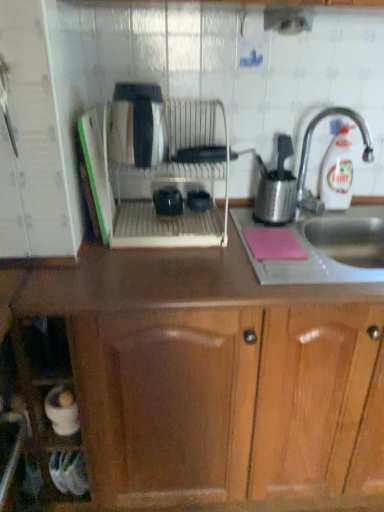
Locate an element on the screen. This screenshot has height=512, width=384. satin silver dish rack at center is located at coordinates (157, 179).

In order to face wooden cabinet at center, should I rotate leftwards or rightwards?

It's best to rotate right around 9.785 degrees.

The width and height of the screenshot is (384, 512). What do you see at coordinates (276, 188) in the screenshot?
I see `stainless steel utensil holder at right` at bounding box center [276, 188].

What do you see at coordinates (309, 154) in the screenshot?
I see `silver metallic tap at right` at bounding box center [309, 154].

The width and height of the screenshot is (384, 512). What do you see at coordinates (326, 248) in the screenshot?
I see `metallic sink at right` at bounding box center [326, 248].

Measure the distance between metallic sink at right and camera.

They are 38.24 inches apart.

Locate an element on the screen. Image resolution: width=384 pixels, height=512 pixels. satin silver dish rack at center is located at coordinates (157, 179).

Who is smaller, silver metallic tap at right or wooden cabinet at center?

silver metallic tap at right is smaller.

Which is more to the left, silver metallic tap at right or wooden cabinet at center?

wooden cabinet at center.

Is silver metallic tap at right thinner than wooden cabinet at center?

Correct, the width of silver metallic tap at right is less than that of wooden cabinet at center.

Is the depth of white plastic bottle at upper right greater than that of satin silver dish rack at center?

Yes, it is behind satin silver dish rack at center.

In terms of width, does white plastic bottle at upper right look wider or thinner when compared to satin silver dish rack at center?

white plastic bottle at upper right is thinner than satin silver dish rack at center.

From a real-world perspective, is white plastic bottle at upper right physically located above or below satin silver dish rack at center?

Clearly, from a real-world perspective, white plastic bottle at upper right is below satin silver dish rack at center.

Is white plastic bottle at upper right touching satin silver dish rack at center?

No, white plastic bottle at upper right is not with satin silver dish rack at center.

Based on their sizes in the image, would you say matte black mugs at center, which is the second appliance in right-to-left order, is bigger or smaller than pink matte notepad at lower right?

matte black mugs at center, which is the second appliance in right-to-left order, is smaller than pink matte notepad at lower right.

In the scene shown: Is the depth of matte black mugs at center, which is the first appliance in left-to-right order, less than that of pink matte notepad at lower right?

No, matte black mugs at center, which is the first appliance in left-to-right order, is further to the viewer.

From a real-world perspective, is matte black mugs at center, which is the first appliance in left-to-right order, positioned above or below pink matte notepad at lower right?

From a real-world perspective, matte black mugs at center, which is the first appliance in left-to-right order, is physically above pink matte notepad at lower right.

Is matte black mugs at center, which is the first appliance in left-to-right order, touching pink matte notepad at lower right?

No, matte black mugs at center, which is the first appliance in left-to-right order, is not touching pink matte notepad at lower right.

Is point (255, 246) farther from camera compared to point (337, 109)?

No, (255, 246) is in front of (337, 109).

Is pink matte notepad at lower right aimed at silver metallic tap at right?

No, pink matte notepad at lower right is not aimed at silver metallic tap at right.

Can you confirm if pink matte notepad at lower right is taller than silver metallic tap at right?

No.

Which object is closer to the camera, pink matte notepad at lower right or silver metallic tap at right?

silver metallic tap at right.

Does silver metallic tap at right have a greater height compared to metallic sink at right?

Indeed, silver metallic tap at right has a greater height compared to metallic sink at right.

From a real-world perspective, is silver metallic tap at right physically located above or below metallic sink at right?

silver metallic tap at right is situated higher than metallic sink at right in the real world.

Is silver metallic tap at right positioned before metallic sink at right?

No, silver metallic tap at right is further to the viewer.

In the scene shown: From the image's perspective, which is below, silver metallic tap at right or metallic sink at right?

From the image's view, metallic sink at right is below.

Consider the image. Can we say white plastic bottle at upper right lies outside black plastic bowls at center, which is the 2th appliance in left-to-right order?

That's correct, white plastic bottle at upper right is outside of black plastic bowls at center, which is the 2th appliance in left-to-right order.

From a real-world perspective, which object stands above the other?

From a 3D spatial view, white plastic bottle at upper right is above.

Is white plastic bottle at upper right facing towards black plastic bowls at center, arranged as the first appliance when viewed from the right?

No.

Between point (332, 206) and point (201, 211), which one is positioned behind?

Positioned behind is point (332, 206).

Between metallic sink at right and white plastic bottle at upper right, which one appears on the left side from the viewer's perspective?

metallic sink at right is more to the left.

Could you tell me if metallic sink at right is facing white plastic bottle at upper right?

No, metallic sink at right is not oriented towards white plastic bottle at upper right.

Find the location of a particular element. This screenshot has height=512, width=384. cleaning product behind the metallic sink at right is located at coordinates (337, 170).

From a real-world perspective, which is physically below, metallic sink at right or white plastic bottle at upper right?

metallic sink at right, from a real-world perspective.

You are a GUI agent. You are given a task and a screenshot of the screen. Output one action in this format:
    pyautogui.click(x=<x>, y=<y>)
    Task: Click on the tap lying on the right of wooden cabinet at center
    
    Given the screenshot: What is the action you would take?
    pyautogui.click(x=309, y=154)

At what (x,y) coordinates should I click in order to perform the action: click on home appliance on the left of white plastic bottle at upper right. Please return your answer as a coordinate pair (x, y). Looking at the image, I should click on (157, 179).

From the image, which object appears to be farther from pink matte notepad at lower right, silver metallic tap at right or satin silver dish rack at center?

satin silver dish rack at center is positioned further to the anchor pink matte notepad at lower right.

Based on their spatial positions, is white plastic bottle at upper right or pink matte notepad at lower right further from satin silver dish rack at center?

Based on the image, white plastic bottle at upper right appears to be further to satin silver dish rack at center.

Looking at the image, which one is located further to silver metallic tap at right, metallic sink at right or wooden cabinet at center?

Among the two, wooden cabinet at center is located further to silver metallic tap at right.

Based on their spatial positions, is matte black mugs at center, which is the first appliance in left-to-right order, or wooden cabinet at center further from stainless steel utensil holder at right?

Based on the image, wooden cabinet at center appears to be further to stainless steel utensil holder at right.

Which object lies nearer to the anchor point satin silver dish rack at center, white plastic bottle at upper right or stainless steel utensil holder at right?

Based on the image, stainless steel utensil holder at right appears to be nearer to satin silver dish rack at center.

Estimate the real-world distances between objects in this image. Which object is further from silver metallic tap at right, white plastic bottle at upper right or black plastic bowls at center, arranged as the first appliance when viewed from the right?

Based on the image, black plastic bowls at center, arranged as the first appliance when viewed from the right, appears to be further to silver metallic tap at right.

Looking at the image, which one is located further to wooden cabinet at center, black plastic bowls at center, arranged as the first appliance when viewed from the right, or matte black mugs at center, which is the first appliance in left-to-right order?

The object further to wooden cabinet at center is black plastic bowls at center, arranged as the first appliance when viewed from the right.

Which object lies nearer to the anchor point pink matte notepad at lower right, wooden cabinet at center or stainless steel utensil holder at right?

Based on the image, stainless steel utensil holder at right appears to be nearer to pink matte notepad at lower right.

Find the location of a particular element. The width and height of the screenshot is (384, 512). sink between satin silver dish rack at center and wooden cabinet at center from top to bottom is located at coordinates (326, 248).

Image resolution: width=384 pixels, height=512 pixels. What are the coordinates of `notepad between silver metallic tap at right and metallic sink at right in the up-down direction` in the screenshot? It's located at (273, 244).

Identify the location of notepad situated between satin silver dish rack at center and stainless steel utensil holder at right from left to right. (273, 244).

At what (x,y) coordinates should I click in order to perform the action: click on sink located between satin silver dish rack at center and white plastic bottle at upper right in the left-right direction. Please return your answer as a coordinate pair (x, y). Looking at the image, I should click on (326, 248).